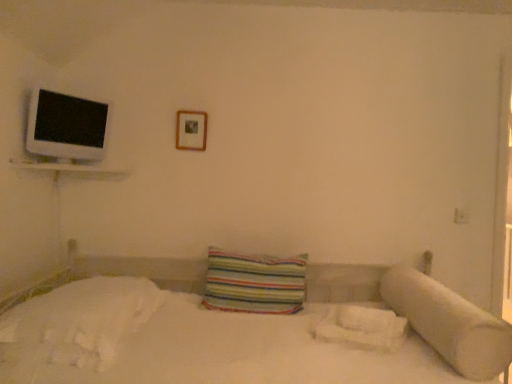
Question: From the image's perspective, is white soft bedsheet at lower left, arranged as the 2th sheet when viewed from the right, located above striped fabric pillow at center, the 1th pillow when ordered from left to right?

Choices:
 (A) no
 (B) yes

Answer: (A)

Question: Is white soft bedsheet at lower left, arranged as the 2th sheet when viewed from the right, shorter than striped fabric pillow at center, the 1th pillow when ordered from left to right?

Choices:
 (A) yes
 (B) no

Answer: (A)

Question: Is white soft bedsheet at lower left, arranged as the 2th sheet when viewed from the right, closer to camera compared to striped fabric pillow at center, the 1th pillow when ordered from left to right?

Choices:
 (A) yes
 (B) no

Answer: (A)

Question: From a real-world perspective, is white soft bedsheet at lower left, arranged as the 2th sheet when viewed from the right, beneath striped fabric pillow at center, which is the 2th pillow in right-to-left order?

Choices:
 (A) yes
 (B) no

Answer: (A)

Question: Does white soft bedsheet at lower left, arranged as the 2th sheet when viewed from the right, have a larger size compared to striped fabric pillow at center, the 1th pillow when ordered from left to right?

Choices:
 (A) yes
 (B) no

Answer: (A)

Question: Choose the correct answer: Is white fluffy sheet at lower right, arranged as the first sheet when viewed from the right, inside white glossy flat at upper left or outside it?

Choices:
 (A) outside
 (B) inside

Answer: (A)

Question: Looking at the image, does white fluffy sheet at lower right, arranged as the first sheet when viewed from the right, seem bigger or smaller compared to white glossy flat at upper left?

Choices:
 (A) big
 (B) small

Answer: (A)

Question: Considering the positions of white fluffy sheet at lower right, arranged as the first sheet when viewed from the right, and white glossy flat at upper left in the image, is white fluffy sheet at lower right, arranged as the first sheet when viewed from the right, taller or shorter than white glossy flat at upper left?

Choices:
 (A) short
 (B) tall

Answer: (A)

Question: Visually, is white fluffy sheet at lower right, arranged as the first sheet when viewed from the right, positioned to the left or to the right of white glossy flat at upper left?

Choices:
 (A) left
 (B) right

Answer: (B)

Question: Is white fluffy sheet at lower right, the second sheet from the left, inside the boundaries of wooden picture frame at upper center, or outside?

Choices:
 (A) outside
 (B) inside

Answer: (A)

Question: Is point (362, 317) closer or farther from the camera than point (194, 125)?

Choices:
 (A) farther
 (B) closer

Answer: (B)

Question: In terms of width, does white fluffy sheet at lower right, arranged as the first sheet when viewed from the right, look wider or thinner when compared to wooden picture frame at upper center?

Choices:
 (A) wide
 (B) thin

Answer: (A)

Question: From the image's perspective, relative to wooden picture frame at upper center, is white fluffy sheet at lower right, the second sheet from the left, above or below?

Choices:
 (A) below
 (B) above

Answer: (A)

Question: Relative to white fluffy sheet at lower right, arranged as the first sheet when viewed from the right, is wooden picture frame at upper center in front or behind?

Choices:
 (A) front
 (B) behind

Answer: (B)

Question: From a real-world perspective, relative to white fluffy sheet at lower right, the second sheet from the left, is wooden picture frame at upper center vertically above or below?

Choices:
 (A) above
 (B) below

Answer: (A)